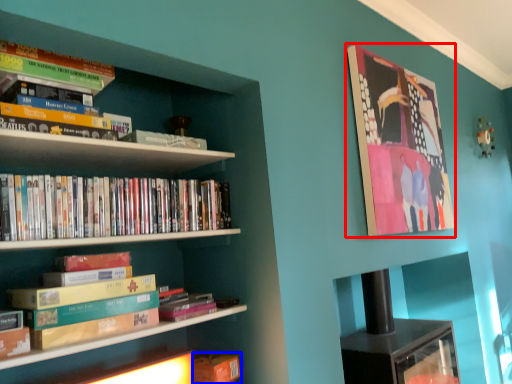
Question: Which point is further to the camera, picture frame (highlighted by a red box) or book (highlighted by a blue box)?

Choices:
 (A) picture frame
 (B) book

Answer: (A)